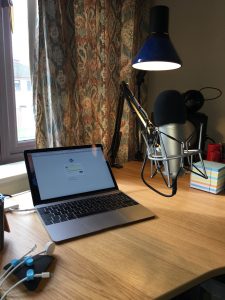
The width and height of the screenshot is (225, 300). In order to click on overhead desk lamp in this screenshot , I will do `click(153, 43)`.